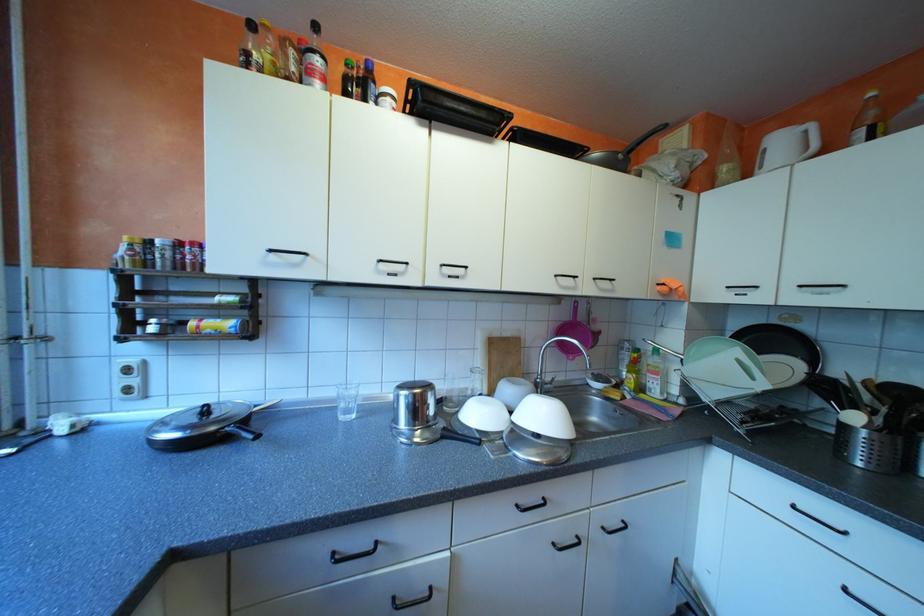
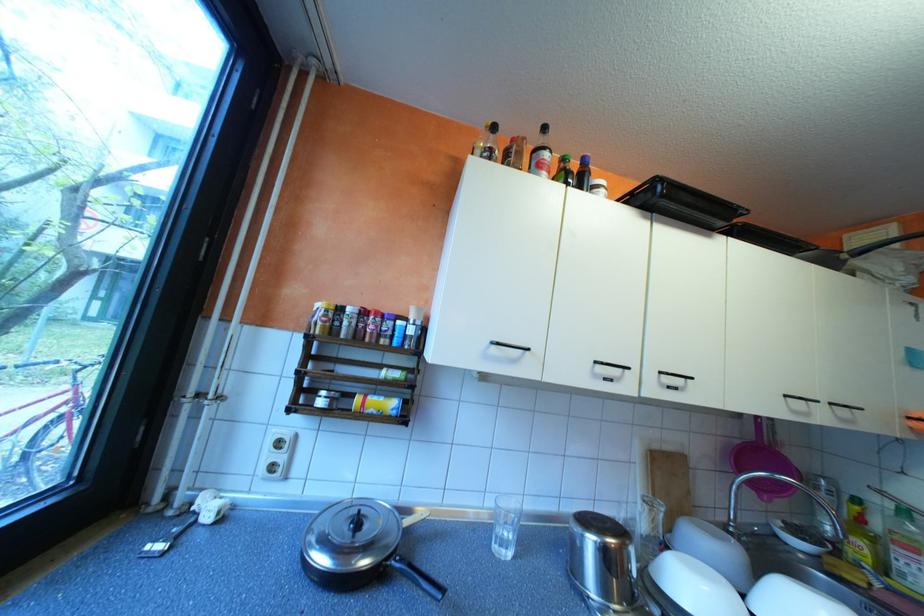
Question: The first image is from the beginning of the video and the second image is from the end. How did the camera likely rotate when shooting the video?

Choices:
 (A) Left
 (B) Right
 (C) Up
 (D) Down

Answer: (C)